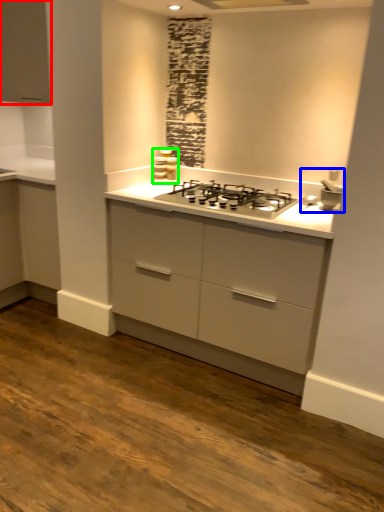
Question: Which object is positioned closest to cabinetry (highlighted by a red box)? Select from sink (highlighted by a blue box) and appliance (highlighted by a green box).

Choices:
 (A) sink
 (B) appliance

Answer: (B)